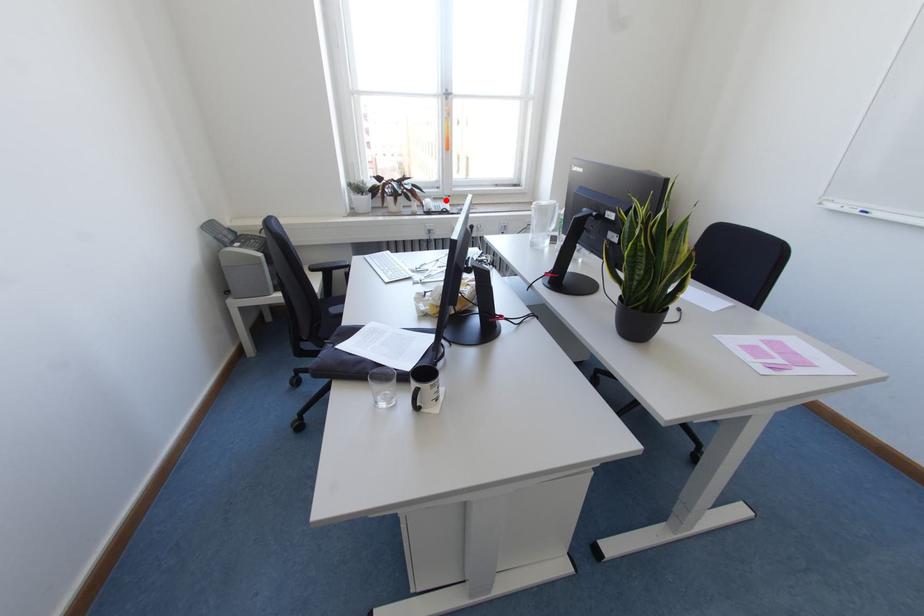
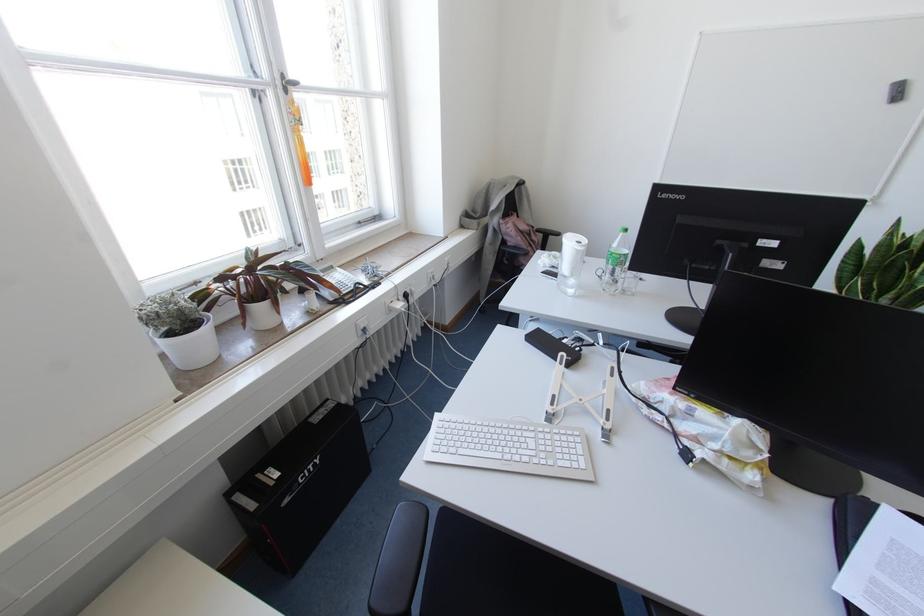
The point at the highlighted location is marked in the first image. Where is the corresponding point in the second image?

(336, 268)